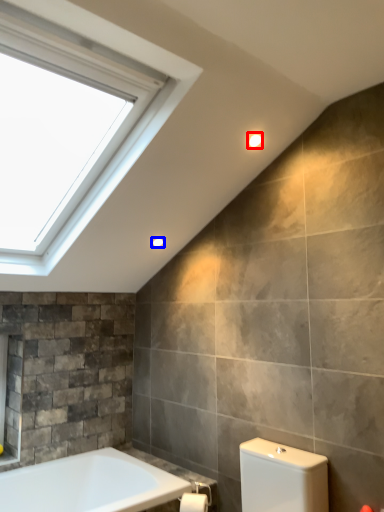
Question: Which point is further to the camera, light fixture (highlighted by a red box) or light fixture (highlighted by a blue box)?

Choices:
 (A) light fixture
 (B) light fixture

Answer: (B)